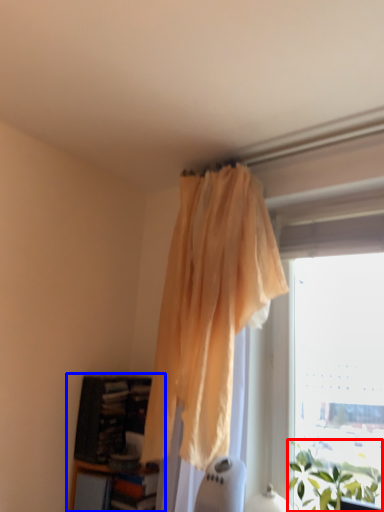
Question: Which of the following is the farthest to the observer, plant (highlighted by a red box) or bookcase (highlighted by a blue box)?

Choices:
 (A) plant
 (B) bookcase

Answer: (B)